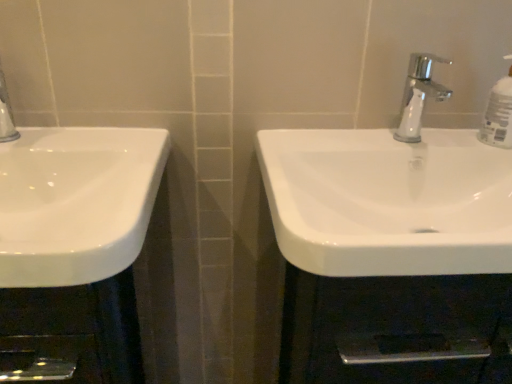
Where is `clear plastic bottle at upper right`? This screenshot has height=384, width=512. clear plastic bottle at upper right is located at coordinates (498, 115).

The image size is (512, 384). What do you see at coordinates (391, 196) in the screenshot? I see `white glossy sink at center, the 2th sink when ordered from left to right` at bounding box center [391, 196].

The image size is (512, 384). Describe the element at coordinates (74, 200) in the screenshot. I see `white glossy sink at left, which is the first sink in left-to-right order` at that location.

What are the coordinates of `chrome metallic faucet at upper center` in the screenshot? It's located at (418, 95).

What's the angular difference between white glossy sink at left, placed as the second sink when sorted from right to left, and chrome metallic faucet at upper center's facing directions?

white glossy sink at left, placed as the second sink when sorted from right to left, and chrome metallic faucet at upper center are facing 0.338 degrees away from each other.

Which of these two, white glossy sink at left, placed as the second sink when sorted from right to left, or chrome metallic faucet at upper center, stands shorter?

Standing shorter between the two is white glossy sink at left, placed as the second sink when sorted from right to left.

Which is correct: white glossy sink at left, placed as the second sink when sorted from right to left, is inside chrome metallic faucet at upper center, or outside of it?

white glossy sink at left, placed as the second sink when sorted from right to left, is outside chrome metallic faucet at upper center.

Is chrome metallic faucet at upper center at the back of white glossy sink at left, which is the first sink in left-to-right order?

white glossy sink at left, which is the first sink in left-to-right order, does not have its back to chrome metallic faucet at upper center.

Considering the relative positions of clear plastic bottle at upper right and white glossy sink at center, which appears as the first sink when viewed from the right, in the image provided, is clear plastic bottle at upper right to the right of white glossy sink at center, which appears as the first sink when viewed from the right, from the viewer's perspective?

Correct, you'll find clear plastic bottle at upper right to the right of white glossy sink at center, which appears as the first sink when viewed from the right.

Consider the image. How different are the orientations of clear plastic bottle at upper right and white glossy sink at center, which appears as the first sink when viewed from the right, in degrees?

0.000994 degrees.

Is clear plastic bottle at upper right inside or outside of white glossy sink at center, the 2th sink when ordered from left to right?

clear plastic bottle at upper right is not inside white glossy sink at center, the 2th sink when ordered from left to right, it's outside.

Considering the relative sizes of clear plastic bottle at upper right and white glossy sink at center, which appears as the first sink when viewed from the right, in the image provided, is clear plastic bottle at upper right shorter than white glossy sink at center, which appears as the first sink when viewed from the right,?

In fact, clear plastic bottle at upper right may be taller than white glossy sink at center, which appears as the first sink when viewed from the right.

Which object is wider, white glossy sink at center, which appears as the first sink when viewed from the right, or clear plastic bottle at upper right?

white glossy sink at center, which appears as the first sink when viewed from the right, is wider.

Is white glossy sink at center, which appears as the first sink when viewed from the right, far away from clear plastic bottle at upper right?

No, there isn't a large distance between white glossy sink at center, which appears as the first sink when viewed from the right, and clear plastic bottle at upper right.

Between white glossy sink at center, the 2th sink when ordered from left to right, and clear plastic bottle at upper right, which one appears on the left side from the viewer's perspective?

white glossy sink at center, the 2th sink when ordered from left to right.

Which of these two, white glossy sink at center, which appears as the first sink when viewed from the right, or clear plastic bottle at upper right, is smaller?

clear plastic bottle at upper right.

Are chrome metallic faucet at upper center and white glossy sink at center, the 2th sink when ordered from left to right, located far from each other?

No, there isn't a large distance between chrome metallic faucet at upper center and white glossy sink at center, the 2th sink when ordered from left to right.

From a real-world perspective, does chrome metallic faucet at upper center sit lower than white glossy sink at center, the 2th sink when ordered from left to right?

No, from a real-world perspective, chrome metallic faucet at upper center is not below white glossy sink at center, the 2th sink when ordered from left to right.

Could you measure the distance between chrome metallic faucet at upper center and white glossy sink at center, the 2th sink when ordered from left to right?

6.35 inches.

From the image's perspective, is chrome metallic faucet at upper center above white glossy sink at center, the 2th sink when ordered from left to right?

Yes.

Can you confirm if clear plastic bottle at upper right is thinner than chrome metallic faucet at upper center?

Indeed, clear plastic bottle at upper right has a lesser width compared to chrome metallic faucet at upper center.

Find the location of a particular element. soap dispenser behind the chrome metallic faucet at upper center is located at coordinates (498, 115).

Which object is positioned more to the left, clear plastic bottle at upper right or chrome metallic faucet at upper center?

chrome metallic faucet at upper center is more to the left.

Would you say clear plastic bottle at upper right is outside chrome metallic faucet at upper center?

clear plastic bottle at upper right lies outside chrome metallic faucet at upper center's area.

Is white glossy sink at left, placed as the second sink when sorted from right to left, placed right next to clear plastic bottle at upper right?

No, white glossy sink at left, placed as the second sink when sorted from right to left, is not making contact with clear plastic bottle at upper right.

Which of these two, white glossy sink at left, placed as the second sink when sorted from right to left, or clear plastic bottle at upper right, is smaller?

Smaller between the two is clear plastic bottle at upper right.

Is white glossy sink at left, placed as the second sink when sorted from right to left, facing towards clear plastic bottle at upper right?

No, white glossy sink at left, placed as the second sink when sorted from right to left, is not turned towards clear plastic bottle at upper right.

Find the location of a particular element. the 1st sink directly beneath the clear plastic bottle at upper right (from a real-world perspective) is located at coordinates [74, 200].

From the image's perspective, is white glossy sink at center, the 2th sink when ordered from left to right, above chrome metallic faucet at upper center?

No, from the image's perspective, white glossy sink at center, the 2th sink when ordered from left to right, is not on top of chrome metallic faucet at upper center.

Considering the relative positions of white glossy sink at center, which appears as the first sink when viewed from the right, and chrome metallic faucet at upper center in the image provided, is white glossy sink at center, which appears as the first sink when viewed from the right, to the left of chrome metallic faucet at upper center from the viewer's perspective?

No, white glossy sink at center, which appears as the first sink when viewed from the right, is not to the left of chrome metallic faucet at upper center.

Where is `sink on the right of chrome metallic faucet at upper center`? This screenshot has width=512, height=384. sink on the right of chrome metallic faucet at upper center is located at coordinates (391, 196).

The height and width of the screenshot is (384, 512). Find the location of `tap that appears on the right of white glossy sink at left, placed as the second sink when sorted from right to left`. tap that appears on the right of white glossy sink at left, placed as the second sink when sorted from right to left is located at coordinates (418, 95).

From a real-world perspective, starting from the clear plastic bottle at upper right, which sink is the 2nd one below it? Please provide its 2D coordinates.

[(391, 196)]

Looking at the image, which one is located closer to white glossy sink at center, the 2th sink when ordered from left to right, clear plastic bottle at upper right or chrome metallic faucet at upper center?

Based on the image, chrome metallic faucet at upper center appears to be nearer to white glossy sink at center, the 2th sink when ordered from left to right.

When comparing their distances from white glossy sink at center, the 2th sink when ordered from left to right, does clear plastic bottle at upper right or white glossy sink at left, placed as the second sink when sorted from right to left, seem further?

Based on the image, white glossy sink at left, placed as the second sink when sorted from right to left, appears to be further to white glossy sink at center, the 2th sink when ordered from left to right.

Which object lies nearer to the anchor point white glossy sink at left, which is the first sink in left-to-right order, chrome metallic faucet at upper center or clear plastic bottle at upper right?

chrome metallic faucet at upper center lies closer to white glossy sink at left, which is the first sink in left-to-right order, than the other object.

When comparing their distances from chrome metallic faucet at upper center, does white glossy sink at center, the 2th sink when ordered from left to right, or white glossy sink at left, placed as the second sink when sorted from right to left, seem closer?

white glossy sink at center, the 2th sink when ordered from left to right, is closer to chrome metallic faucet at upper center.

Considering their positions, is white glossy sink at center, the 2th sink when ordered from left to right, positioned further to clear plastic bottle at upper right than white glossy sink at left, which is the first sink in left-to-right order?

Based on the image, white glossy sink at left, which is the first sink in left-to-right order, appears to be further to clear plastic bottle at upper right.

From the picture: Looking at the image, which one is located closer to chrome metallic faucet at upper center, clear plastic bottle at upper right or white glossy sink at center, which appears as the first sink when viewed from the right?

clear plastic bottle at upper right is closer to chrome metallic faucet at upper center.

When comparing their distances from white glossy sink at left, which is the first sink in left-to-right order, does white glossy sink at center, the 2th sink when ordered from left to right, or chrome metallic faucet at upper center seem further?

Among the two, chrome metallic faucet at upper center is located further to white glossy sink at left, which is the first sink in left-to-right order.

Which object lies further to the anchor point white glossy sink at left, which is the first sink in left-to-right order, clear plastic bottle at upper right or chrome metallic faucet at upper center?

clear plastic bottle at upper right lies further to white glossy sink at left, which is the first sink in left-to-right order, than the other object.

Where is `sink between white glossy sink at left, which is the first sink in left-to-right order, and clear plastic bottle at upper right from left to right`? sink between white glossy sink at left, which is the first sink in left-to-right order, and clear plastic bottle at upper right from left to right is located at coordinates (391, 196).

The image size is (512, 384). In order to click on tap between white glossy sink at center, which appears as the first sink when viewed from the right, and clear plastic bottle at upper right from front to back in this screenshot , I will do `click(418, 95)`.

This screenshot has width=512, height=384. In order to click on tap between white glossy sink at left, placed as the second sink when sorted from right to left, and white glossy sink at center, which appears as the first sink when viewed from the right, from left to right in this screenshot , I will do `click(418, 95)`.

This screenshot has width=512, height=384. Identify the location of tap between white glossy sink at left, which is the first sink in left-to-right order, and clear plastic bottle at upper right, in the horizontal direction. (418, 95).